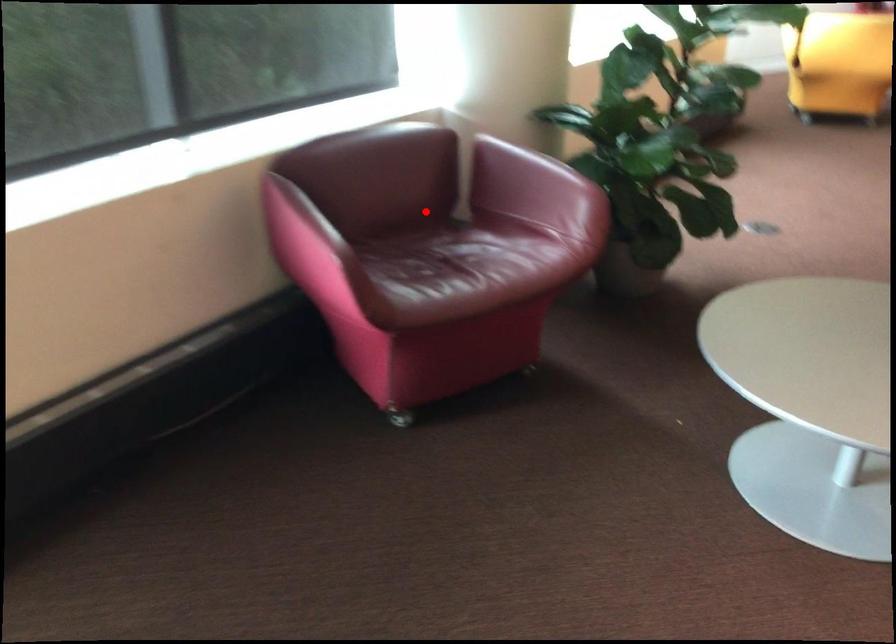
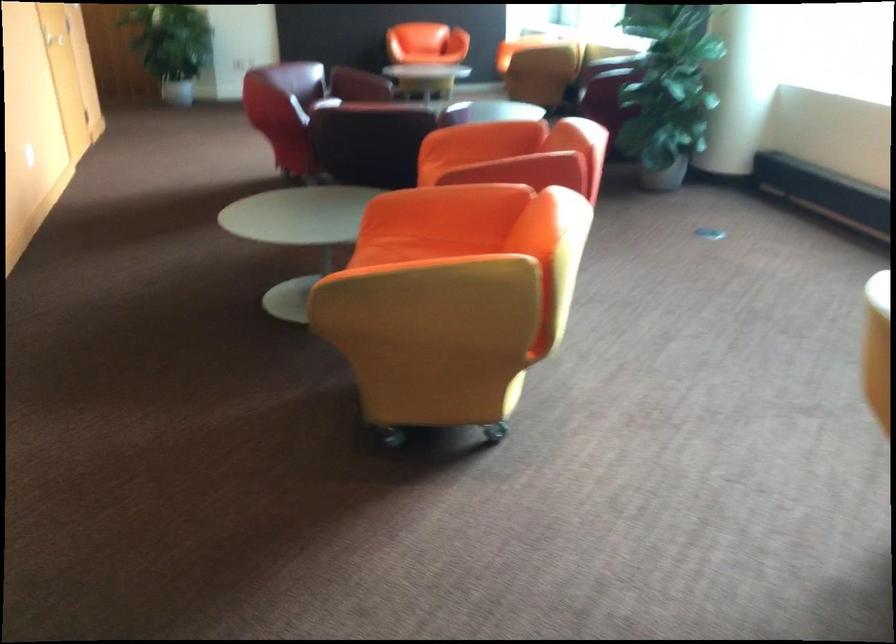
Question: I am providing you with two images of the same scene from different viewpoints. A red point is marked on the first image. Can you still see the location of the red point in image 2?

Choices:
 (A) Yes
 (B) No

Answer: (B)